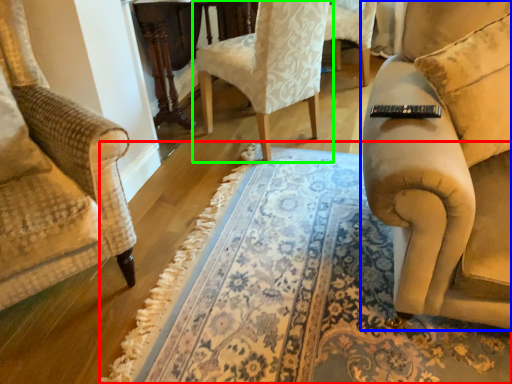
Question: Which object is positioned farthest from mat (highlighted by a red box)? Select from studio couch (highlighted by a blue box) and chair (highlighted by a green box).

Choices:
 (A) studio couch
 (B) chair

Answer: (B)